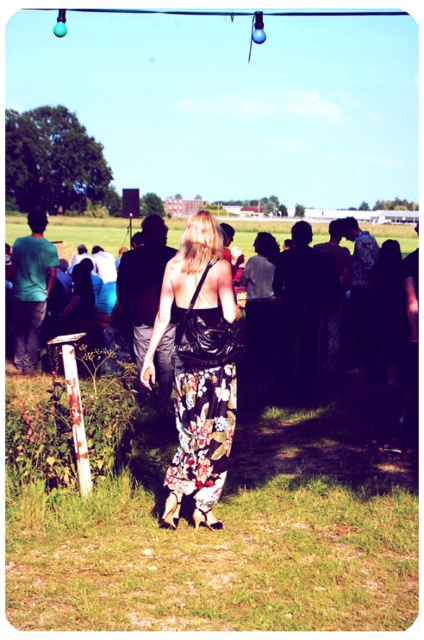
Is leather sandal at lower center above white fabric sandal at lower center?

Yes, leather sandal at lower center is above white fabric sandal at lower center.

Between point (173, 492) and point (195, 509), which one is positioned in front?

Point (195, 509) is more forward.

Image resolution: width=424 pixels, height=640 pixels. In order to click on leather sandal at lower center in this screenshot , I will do `click(170, 509)`.

Does floral fabric dress at center have a lesser height compared to leather sandal at lower center?

No, floral fabric dress at center is not shorter than leather sandal at lower center.

Is floral fabric dress at center taller than leather sandal at lower center?

Yes.

You are a GUI agent. You are given a task and a screenshot of the screen. Output one action in this format:
    pyautogui.click(x=<x>, y=<y>)
    Task: Click on the floral fabric dress at center
    This screenshot has height=640, width=424.
    Given the screenshot: What is the action you would take?
    pyautogui.click(x=385, y=307)

Which is behind, point (192, 276) or point (172, 496)?

Point (172, 496)

Locate an element on the screen. The image size is (424, 640). floral-patterned fabric dress at center is located at coordinates (200, 433).

The image size is (424, 640). What are the coordinates of `floral-patterned fabric dress at center` in the screenshot? It's located at (200, 433).